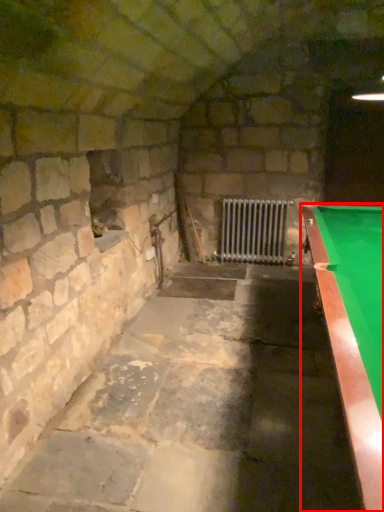
Question: From the image's perspective, what is the correct spatial relationship of billiard table (annotated by the red box) in relation to radiator?

Choices:
 (A) below
 (B) above

Answer: (A)